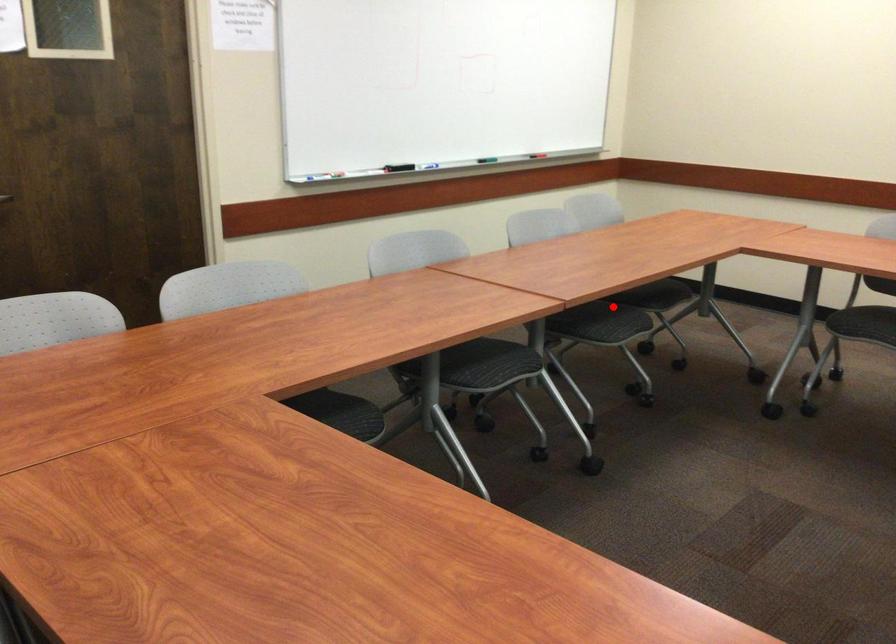
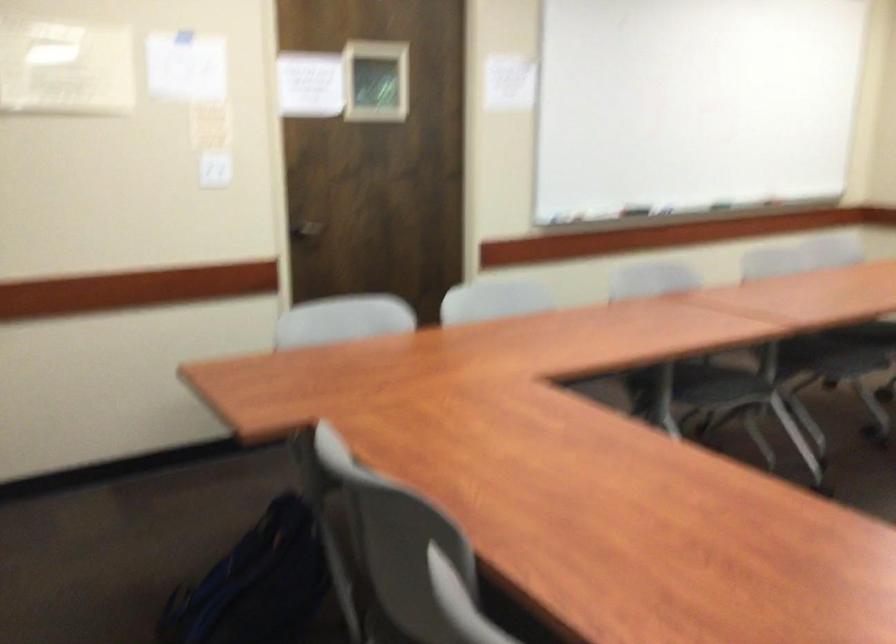
The point at the highlighted location is marked in the first image. Where is the corresponding point in the second image?

(860, 341)